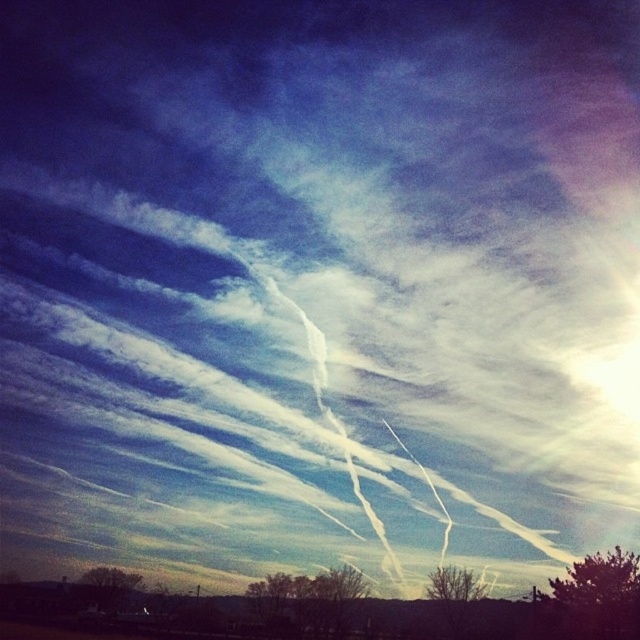
Question: Can you confirm if bare branches at lower center is bigger than brown textured tree at lower right?

Choices:
 (A) no
 (B) yes

Answer: (B)

Question: Which point is farther from the camera taking this photo?

Choices:
 (A) (129, 589)
 (B) (333, 636)

Answer: (A)

Question: Which of these objects is positioned farthest from the brown textured tree at lower left?

Choices:
 (A) brown textured tree at lower right
 (B) bare branches at lower center
 (C) green leafy tree at lower right

Answer: (C)

Question: Considering the relative positions of bare branches at lower center and brown textured tree at lower left in the image provided, where is bare branches at lower center located with respect to brown textured tree at lower left?

Choices:
 (A) below
 (B) above

Answer: (B)

Question: Does bare branches at lower center have a lesser width compared to brown textured tree at lower left?

Choices:
 (A) no
 (B) yes

Answer: (B)

Question: Which point is farther to the camera?

Choices:
 (A) brown textured tree at lower right
 (B) green leafy tree at lower right
 (C) brown textured tree at lower left

Answer: (C)